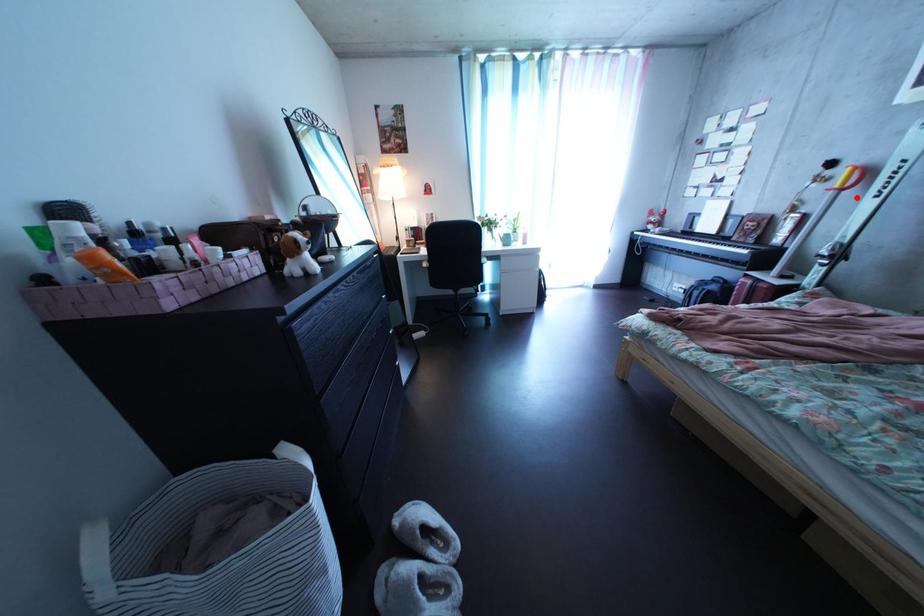
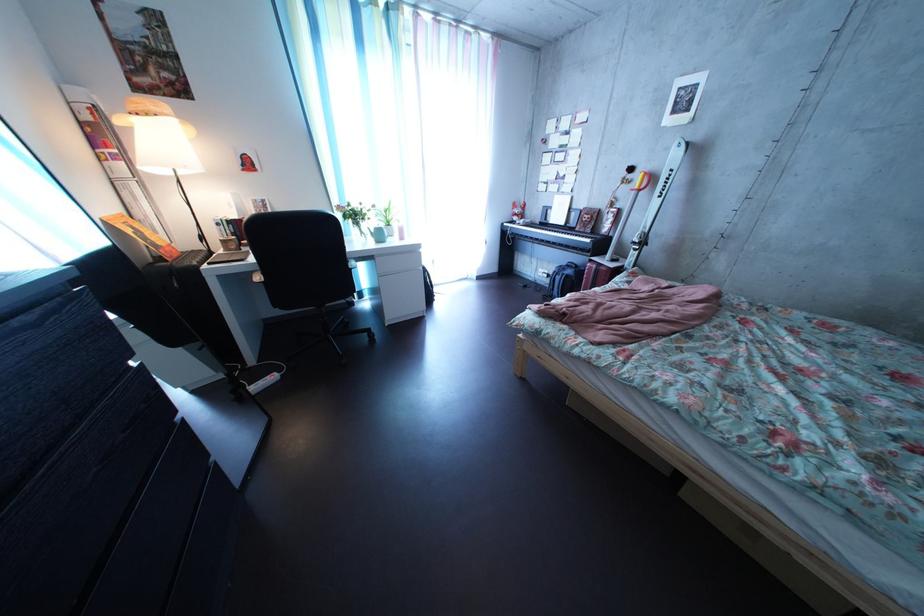
Question: I am providing you with two images of the same scene from different viewpoints. Given a red point in image1, look at the same physical point in image2. Is it:

Choices:
 (A) Closer to the viewpoint
 (B) Farther from the viewpoint

Answer: (A)